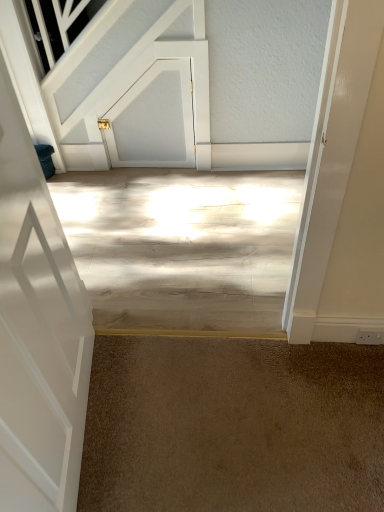
Question: From a real-world perspective, is brown carpet at lower center physically above white glossy door at left, marked as the first door in a front-to-back arrangement?

Choices:
 (A) yes
 (B) no

Answer: (B)

Question: Considering the relative sizes of brown carpet at lower center and white glossy door at left, marked as the first door in a front-to-back arrangement, in the image provided, is brown carpet at lower center shorter than white glossy door at left, marked as the first door in a front-to-back arrangement,?

Choices:
 (A) yes
 (B) no

Answer: (A)

Question: From the image's perspective, does brown carpet at lower center appear higher than white glossy door at left, acting as the 1th door starting from the bottom?

Choices:
 (A) yes
 (B) no

Answer: (B)

Question: Can you confirm if brown carpet at lower center is smaller than white glossy door at left, which ranks as the 2th door in back-to-front order?

Choices:
 (A) no
 (B) yes

Answer: (B)

Question: Is the surface of brown carpet at lower center in direct contact with white glossy door at left, the 2th door from the top?

Choices:
 (A) yes
 (B) no

Answer: (B)

Question: From the image's perspective, is brown carpet at lower center located beneath white glossy door at left, acting as the 1th door starting from the bottom?

Choices:
 (A) no
 (B) yes

Answer: (B)

Question: From the image's perspective, is white matte door at upper center, the first door viewed from the back, located above brown carpet at lower center?

Choices:
 (A) no
 (B) yes

Answer: (B)

Question: Are white matte door at upper center, the second door viewed from the front, and brown carpet at lower center located far from each other?

Choices:
 (A) no
 (B) yes

Answer: (B)

Question: Is white matte door at upper center, the first door viewed from the back, aimed at brown carpet at lower center?

Choices:
 (A) yes
 (B) no

Answer: (A)

Question: Does white matte door at upper center, the 1th door viewed from the top, have a lesser width compared to brown carpet at lower center?

Choices:
 (A) yes
 (B) no

Answer: (A)

Question: From a real-world perspective, is white matte door at upper center, the first door viewed from the back, positioned over brown carpet at lower center based on gravity?

Choices:
 (A) no
 (B) yes

Answer: (B)

Question: Considering the relative positions of white matte door at upper center, the second door viewed from the front, and brown carpet at lower center in the image provided, is white matte door at upper center, the second door viewed from the front, to the left of brown carpet at lower center from the viewer's perspective?

Choices:
 (A) no
 (B) yes

Answer: (B)

Question: Can you confirm if white glossy door at left, marked as the first door in a front-to-back arrangement, is shorter than white matte door at upper center, the 2th door ordered from the bottom?

Choices:
 (A) yes
 (B) no

Answer: (B)